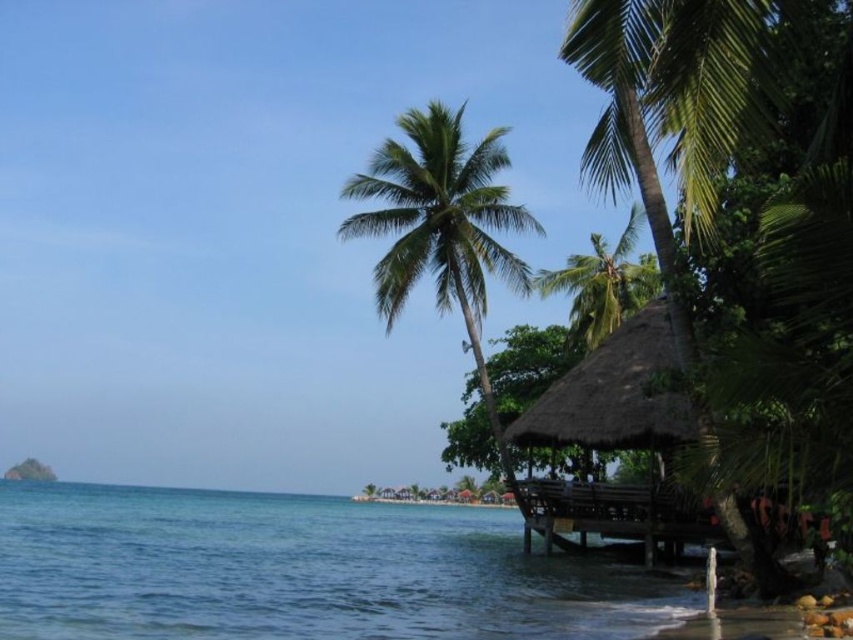
Question: Which of the following is the closest to the observer?

Choices:
 (A) thatched wood hut at right
 (B) green leafy palm tree at center
 (C) green leafy palm tree at center-right
 (D) clear blue water at lower left

Answer: (D)

Question: Is thatched wood hut at right positioned in front of green leafy palm tree at center-right?

Choices:
 (A) yes
 (B) no

Answer: (A)

Question: Which point appears farthest from the camera in this image?

Choices:
 (A) (393, 538)
 (B) (438, 144)
 (C) (567, 292)
 (D) (669, 420)

Answer: (C)

Question: Which of the following is the farthest from the observer?

Choices:
 (A) (485, 280)
 (B) (598, 262)
 (C) (302, 544)
 (D) (640, 310)

Answer: (B)

Question: Is green leafy palm tree at center to the right of green leafy palm tree at center-right from the viewer's perspective?

Choices:
 (A) yes
 (B) no

Answer: (B)

Question: In this image, where is green leafy palm tree at center located relative to thatched wood hut at right?

Choices:
 (A) right
 (B) left

Answer: (B)